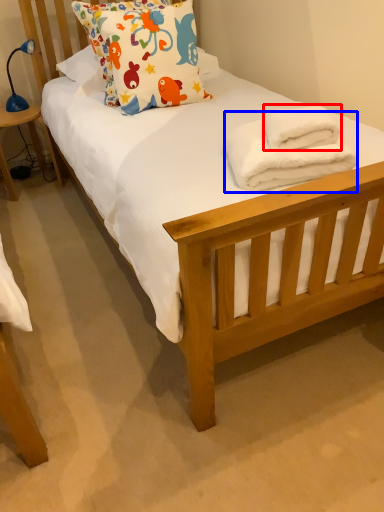
Question: Among these objects, which one is farthest to the camera, bath towel (highlighted by a red box) or bath towel (highlighted by a blue box)?

Choices:
 (A) bath towel
 (B) bath towel

Answer: (A)